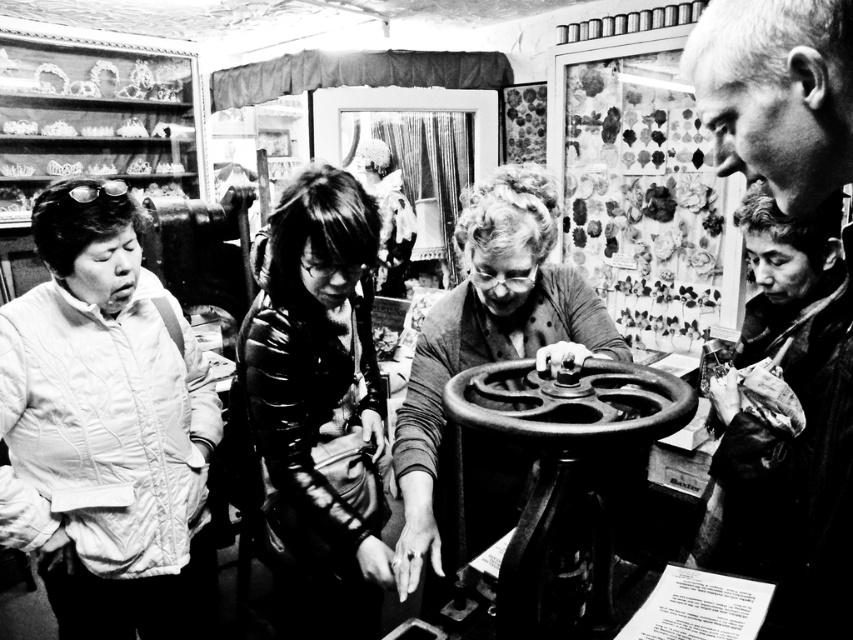
Which is above, quilted white jacket at left or glossy black jacket at center?

quilted white jacket at left is above.

Is quilted white jacket at left bigger than glossy black jacket at center?

Incorrect, quilted white jacket at left is not larger than glossy black jacket at center.

What are the coordinates of `quilted white jacket at left` in the screenshot? It's located at (103, 424).

Locate an element on the screen. quilted white jacket at left is located at coordinates (103, 424).

Is quilted white jacket at left wider than smooth black sewing machine at center?

No.

From the picture: Is quilted white jacket at left shorter than smooth black sewing machine at center?

No, quilted white jacket at left is not shorter than smooth black sewing machine at center.

The height and width of the screenshot is (640, 853). Find the location of `quilted white jacket at left`. quilted white jacket at left is located at coordinates (103, 424).

Image resolution: width=853 pixels, height=640 pixels. What are the coordinates of `quilted white jacket at left` in the screenshot? It's located at (x=103, y=424).

Which is below, smooth gray hair at upper right or smooth black sewing machine at center?

smooth black sewing machine at center

Is point (816, 173) less distant than point (593, 291)?

Yes, point (816, 173) is in front of point (593, 291).

Where is `smooth gray hair at upper right`? This screenshot has height=640, width=853. smooth gray hair at upper right is located at coordinates (776, 93).